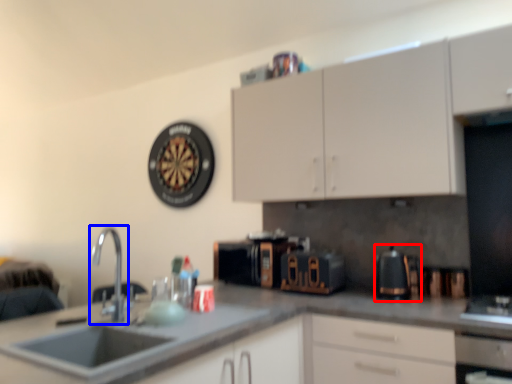
Question: Which of the following is the closest to the observer, coffeepot (highlighted by a red box) or tap (highlighted by a blue box)?

Choices:
 (A) coffeepot
 (B) tap

Answer: (B)